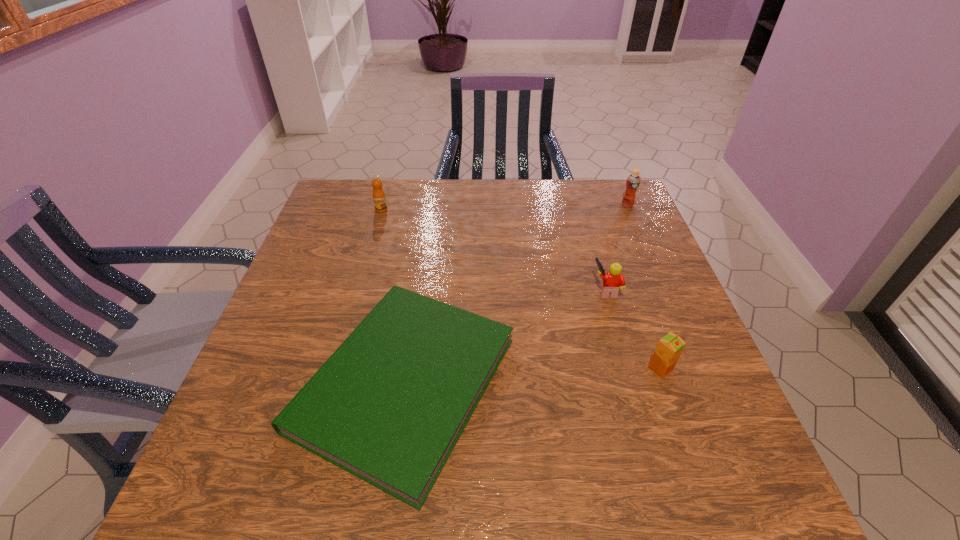
Locate an element on the screen. The image size is (960, 540). the rightmost orange juice is located at coordinates (633, 181).

You are a GUI agent. You are given a task and a screenshot of the screen. Output one action in this format:
    pyautogui.click(x=<x>, y=<y>)
    Task: Click on the leftmost orange juice
    Image resolution: width=960 pixels, height=540 pixels.
    Given the screenshot: What is the action you would take?
    pyautogui.click(x=379, y=198)

The image size is (960, 540). In order to click on the third object from left to right in this screenshot , I will do `click(613, 280)`.

This screenshot has width=960, height=540. In order to click on the second orange juice from left to right in this screenshot , I will do `click(669, 348)`.

I want to click on the nearest orange juice, so click(669, 348).

What are the coordinates of `paperback book` in the screenshot? It's located at (389, 405).

Image resolution: width=960 pixels, height=540 pixels. I want to click on free space located 0.110m on the left of the rightmost orange juice, so click(x=585, y=205).

The width and height of the screenshot is (960, 540). What are the coordinates of `vacant position located on the front label of the leftmost orange juice` in the screenshot? It's located at (374, 233).

You are a GUI agent. You are given a task and a screenshot of the screen. Output one action in this format:
    pyautogui.click(x=<x>, y=<y>)
    Task: Click on the vacant space positioned 0.190m in front of the Lego with the accessory visible
    The image size is (960, 540).
    Given the screenshot: What is the action you would take?
    pyautogui.click(x=516, y=290)

I want to click on vacant space located in front of the Lego with the accessory visible, so click(x=564, y=290).